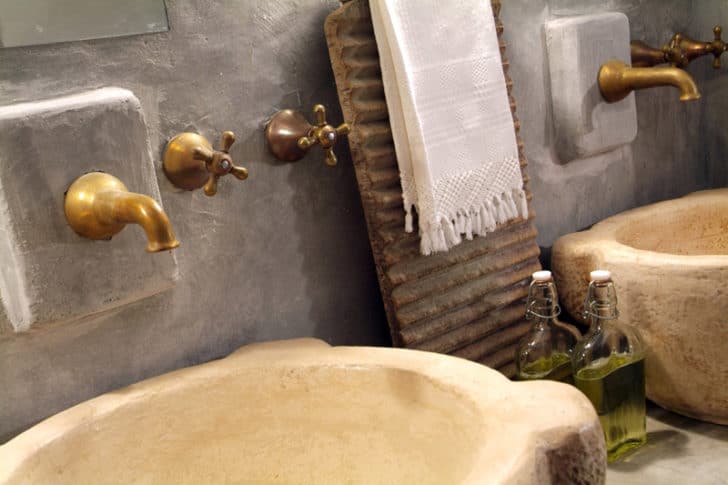
You are a GUI agent. You are given a task and a screenshot of the screen. Output one action in this format:
    pyautogui.click(x=<x>, y=<y>)
    Task: Click on the sink
    The width and height of the screenshot is (728, 485).
    Given the screenshot: What is the action you would take?
    pyautogui.click(x=261, y=440), pyautogui.click(x=692, y=244)